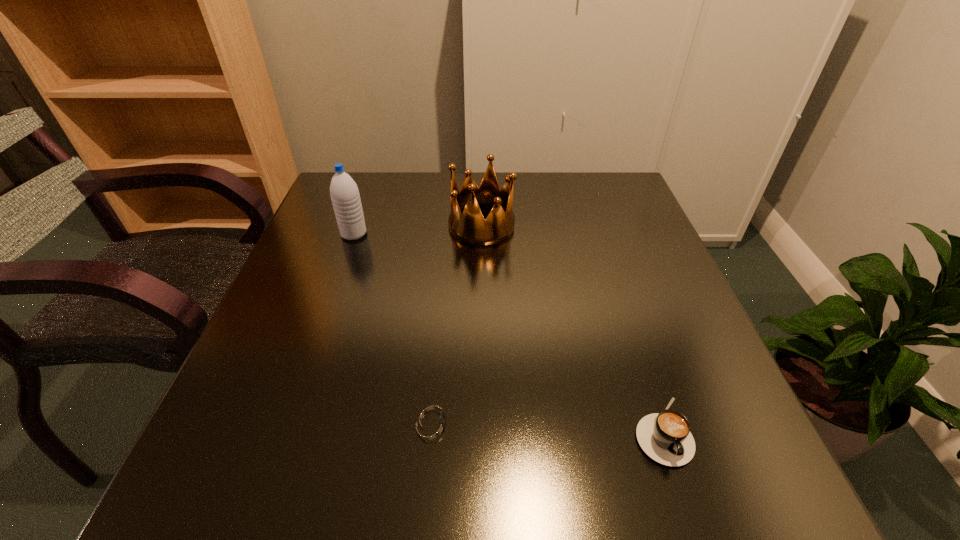
Identify the location of the leftmost object. The image size is (960, 540). (344, 193).

At what (x,y) coordinates should I click in order to perform the action: click on the second tallest object. Please return your answer as a coordinate pair (x, y). Looking at the image, I should click on (470, 227).

At what (x,y) coordinates should I click in order to perform the action: click on cappuccino. Please return your answer as a coordinate pair (x, y). Image resolution: width=960 pixels, height=540 pixels. Looking at the image, I should click on (665, 437).

The height and width of the screenshot is (540, 960). In order to click on the rightmost object in this screenshot , I will do `click(665, 437)`.

At what (x,y) coordinates should I click in order to perform the action: click on watch. Please return your answer as a coordinate pair (x, y). The width and height of the screenshot is (960, 540). Looking at the image, I should click on (433, 422).

Locate an element on the screen. vacant region located 0.050m on the front of the leftmost object is located at coordinates (347, 255).

Where is `vacant space located 0.110m on the left of the crown`? vacant space located 0.110m on the left of the crown is located at coordinates (405, 225).

Where is `free space located on the face of the shortest object`? free space located on the face of the shortest object is located at coordinates (588, 422).

At what (x,y) coordinates should I click in order to perform the action: click on object that is at the far edge. Please return your answer as a coordinate pair (x, y). Image resolution: width=960 pixels, height=540 pixels. Looking at the image, I should click on (470, 227).

Identify the location of cappuccino that is at the near edge. (665, 437).